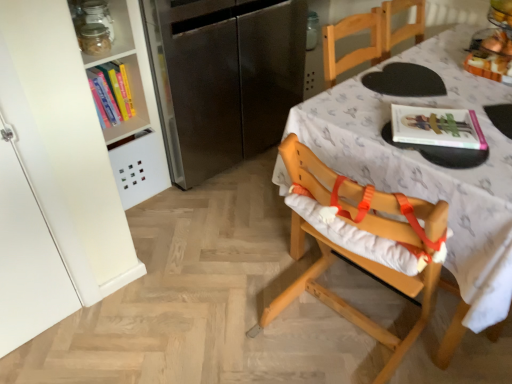
Question: From the image's perspective, is clear glass jar at upper left positioned above or below wooden table at center?

Choices:
 (A) below
 (B) above

Answer: (B)

Question: In terms of width, does clear glass jar at upper left look wider or thinner when compared to wooden table at center?

Choices:
 (A) thin
 (B) wide

Answer: (A)

Question: Which of these objects is positioned farthest from the hardcover book at upper left?

Choices:
 (A) matte pink magazine at upper right
 (B) stainless steel refrigerator at left
 (C) translucent glass bowl at upper right
 (D) wooden table at center
 (E) clear glass jar at upper left

Answer: (C)

Question: Which of these objects is positioned farthest from the stainless steel refrigerator at left?

Choices:
 (A) translucent glass bowl at upper right
 (B) matte pink magazine at upper right
 (C) hardcover book at upper left
 (D) clear glass jar at upper left
 (E) wooden highchair at center

Answer: (A)